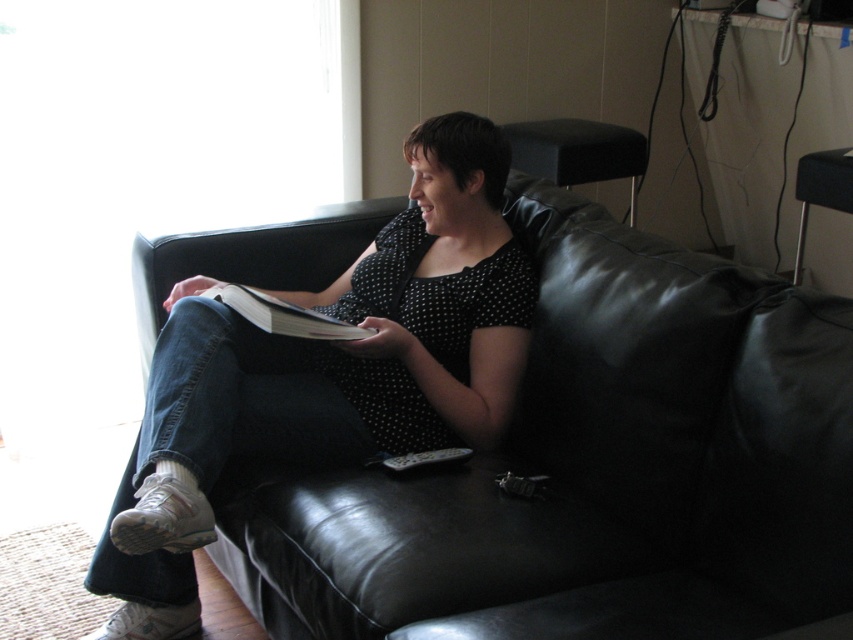
You are standing in the living room and want to pick up an object from the couch. You notice two points on the couch, namely point (144, 321) and point (252, 316). Which point is closer to you?

Point (144, 321) is further to the camera than point (252, 316), so the point closer to you is point (252, 316).

You are standing in the living room and want to place a small object exactly at the point with coordinates (595, 468). According to the scene, where will this object be placed?

The point (595, 468) is on the black leather couch at center, so placing the object there will put it on the couch.

You are a delivery person who needs to place a package on the black leather couch at center and the white paper magazine at center. Which object has a larger surface area to place the package on?

The black leather couch at center has a larger surface area than the white paper magazine at center since its width surpasses the magazine.